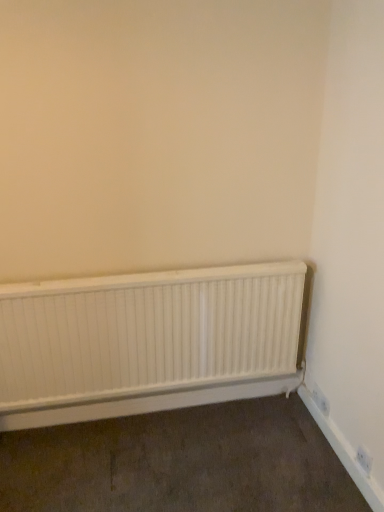
Question: Relative to white matte radiator at lower center, is white plastic electric outlet at lower right in front or behind?

Choices:
 (A) behind
 (B) front

Answer: (A)

Question: In the image, is white plastic electric outlet at lower right on the left side or the right side of white matte radiator at lower center?

Choices:
 (A) left
 (B) right

Answer: (B)

Question: Considering the positions of white plastic electric outlet at lower right and white matte radiator at lower center in the image, is white plastic electric outlet at lower right wider or thinner than white matte radiator at lower center?

Choices:
 (A) wide
 (B) thin

Answer: (B)

Question: In terms of width, does white matte radiator at lower center look wider or thinner when compared to white plastic electric outlet at lower right?

Choices:
 (A) thin
 (B) wide

Answer: (B)

Question: Is white matte radiator at lower center taller or shorter than white plastic electric outlet at lower right?

Choices:
 (A) short
 (B) tall

Answer: (B)

Question: Looking at the image, does white matte radiator at lower center seem bigger or smaller compared to white plastic electric outlet at lower right?

Choices:
 (A) small
 (B) big

Answer: (B)

Question: Would you say white matte radiator at lower center is to the left or to the right of white plastic electric outlet at lower right in the picture?

Choices:
 (A) left
 (B) right

Answer: (A)